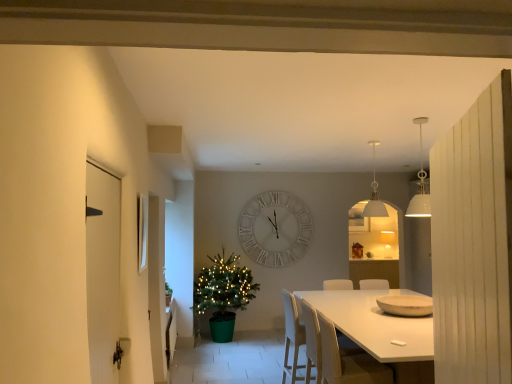
Question: Considering the relative positions of white glossy door at left and wooden bowl at center in the image provided, is white glossy door at left to the left of wooden bowl at center from the viewer's perspective?

Choices:
 (A) yes
 (B) no

Answer: (A)

Question: Does white glossy door at left touch wooden bowl at center?

Choices:
 (A) yes
 (B) no

Answer: (B)

Question: From the image's perspective, would you say white glossy door at left is positioned over wooden bowl at center?

Choices:
 (A) no
 (B) yes

Answer: (B)

Question: Is white glossy door at left smaller than wooden bowl at center?

Choices:
 (A) yes
 (B) no

Answer: (B)

Question: Is white glossy door at left wider than wooden bowl at center?

Choices:
 (A) no
 (B) yes

Answer: (A)

Question: Considering the relative sizes of white glossy door at left and wooden bowl at center in the image provided, is white glossy door at left bigger than wooden bowl at center?

Choices:
 (A) yes
 (B) no

Answer: (A)

Question: From a real-world perspective, is green matte houseplant at left positioned over white glossy door at left based on gravity?

Choices:
 (A) no
 (B) yes

Answer: (A)

Question: Is green matte houseplant at left directly adjacent to white glossy door at left?

Choices:
 (A) yes
 (B) no

Answer: (B)

Question: From the image's perspective, would you say green matte houseplant at left is shown under white glossy door at left?

Choices:
 (A) no
 (B) yes

Answer: (B)

Question: Does green matte houseplant at left have a lesser width compared to white glossy door at left?

Choices:
 (A) no
 (B) yes

Answer: (A)

Question: Is green matte houseplant at left oriented towards white glossy door at left?

Choices:
 (A) yes
 (B) no

Answer: (B)

Question: Does green matte houseplant at left appear on the right side of white glossy door at left?

Choices:
 (A) yes
 (B) no

Answer: (B)

Question: Is white glossy picture frame at upper left positioned behind white glossy door at left?

Choices:
 (A) yes
 (B) no

Answer: (A)